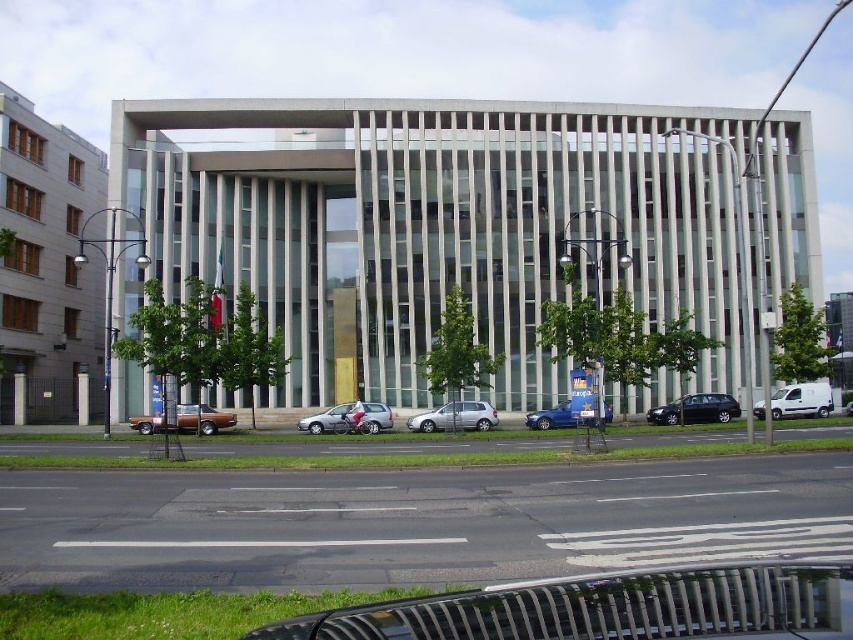
Question: Which is nearer to the white matte van at right?

Choices:
 (A) shiny brown car at lower left
 (B) silver metallic van at center
 (C) silver metallic car at center
 (D) metallic gray station wagon at center-right

Answer: (D)

Question: Can you confirm if metallic gray station wagon at center-right is wider than silver metallic van at center?

Choices:
 (A) yes
 (B) no

Answer: (A)

Question: In this image, where is white matte van at right located relative to silver metallic van at center?

Choices:
 (A) right
 (B) left

Answer: (A)

Question: Among these points, which one is nearest to the camera?

Choices:
 (A) (477, 428)
 (B) (611, 417)
 (C) (375, 413)
 (D) (148, 417)

Answer: (A)

Question: Which point appears closest to the camera in this image?

Choices:
 (A) (668, 404)
 (B) (785, 412)

Answer: (B)

Question: Can you confirm if silver metallic car at center is wider than shiny brown car at lower left?

Choices:
 (A) yes
 (B) no

Answer: (B)